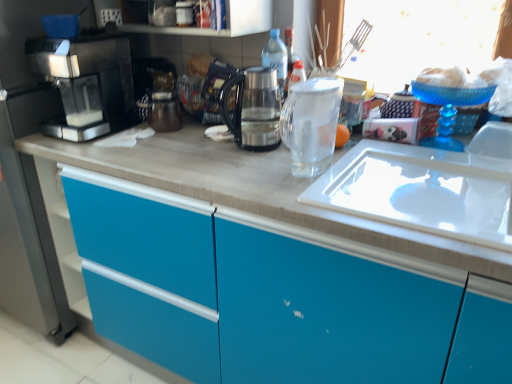
The width and height of the screenshot is (512, 384). I want to click on vacant area that is in front of transparent glass coffee pot at center, placed as the first kitchen appliance when sorted from left to right, so click(x=240, y=168).